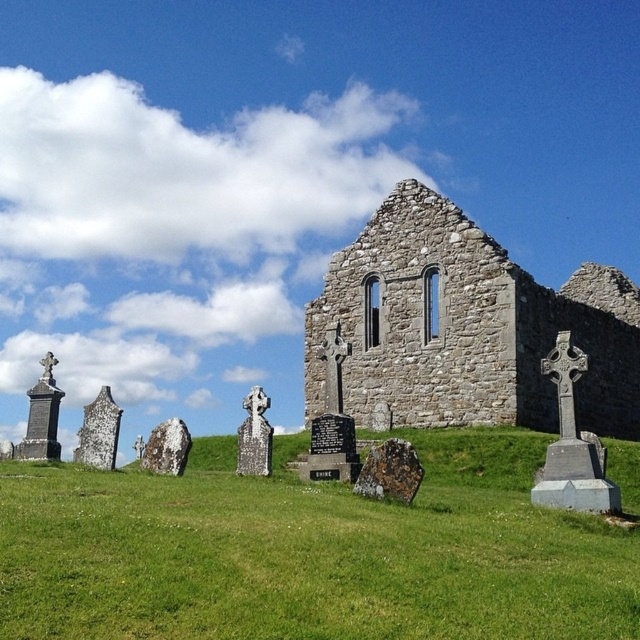
Question: Does stone wall at center lie behind brown stone gravestone at center?

Choices:
 (A) yes
 (B) no

Answer: (A)

Question: Can you confirm if green grass at center is positioned above brown stone gravestone at center?

Choices:
 (A) yes
 (B) no

Answer: (B)

Question: Is green grass at center below brown stone gravestone at center?

Choices:
 (A) no
 (B) yes

Answer: (B)

Question: Which of the following is the closest to the observer?

Choices:
 (A) (396, 241)
 (B) (384, 465)

Answer: (B)

Question: Among these points, which one is farthest from the camera?

Choices:
 (A) (595, 413)
 (B) (388, 490)
 (C) (340, 605)

Answer: (A)

Question: Which point is farther to the camera?

Choices:
 (A) (369, 490)
 (B) (550, 424)
 (C) (68, 616)

Answer: (B)